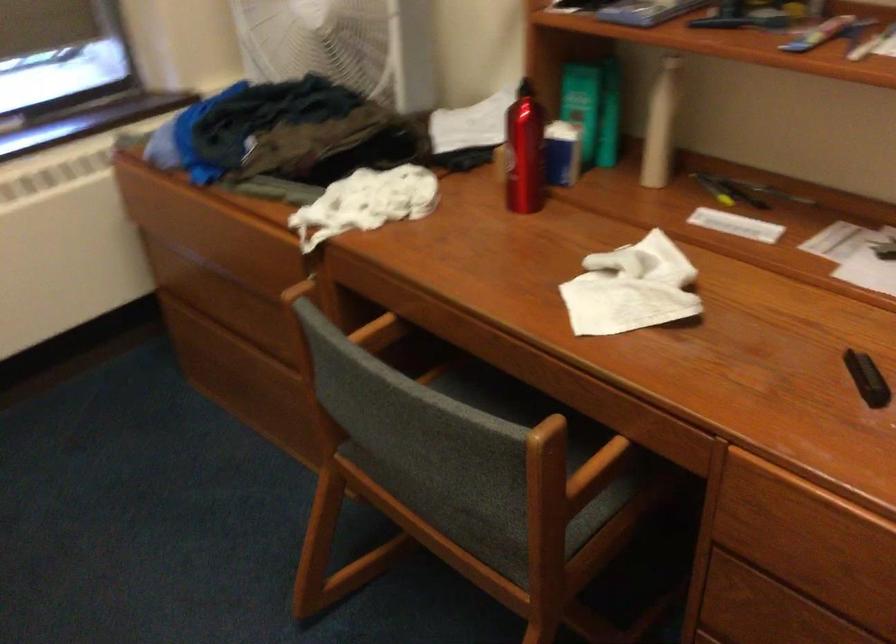
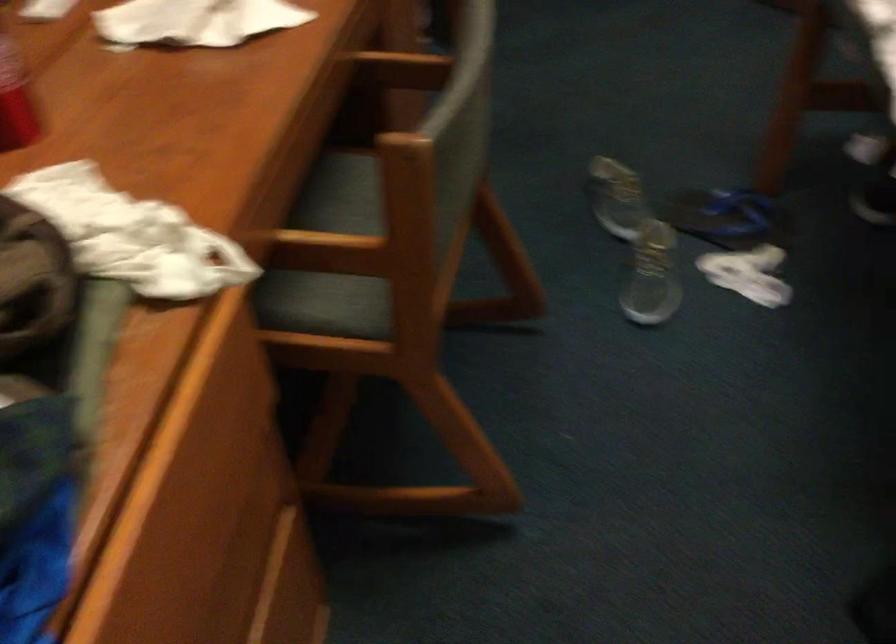
The point at (362,337) is marked in the first image. Where is the corresponding point in the second image?

(339, 250)